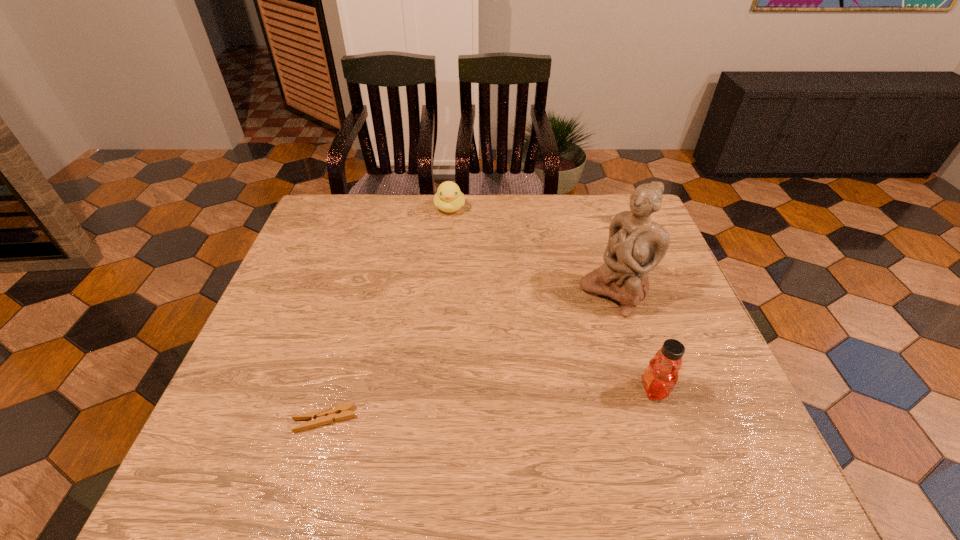
Image resolution: width=960 pixels, height=540 pixels. In order to click on the nearest object in this screenshot , I will do `click(317, 418)`.

Image resolution: width=960 pixels, height=540 pixels. Find the location of `the leftmost object`. the leftmost object is located at coordinates (317, 418).

You are a GUI agent. You are given a task and a screenshot of the screen. Output one action in this format:
    pyautogui.click(x=<x>, y=<y>)
    Task: Click on the second nearest object
    This screenshot has height=540, width=960.
    Given the screenshot: What is the action you would take?
    pyautogui.click(x=661, y=375)

Identify the location of honey. (661, 375).

The image size is (960, 540). I want to click on figurine, so click(636, 244).

I want to click on the third nearest object, so click(x=636, y=244).

This screenshot has height=540, width=960. What are the coordinates of `duckling` in the screenshot? It's located at (449, 198).

This screenshot has width=960, height=540. I want to click on the farthest object, so click(449, 198).

Identify the location of vacant space located 0.330m on the right of the shortest object. The width and height of the screenshot is (960, 540). (518, 420).

Find the location of a particular element. Image resolution: width=960 pixels, height=540 pixels. vacant space situated on the front label of the third shortest object is located at coordinates (466, 389).